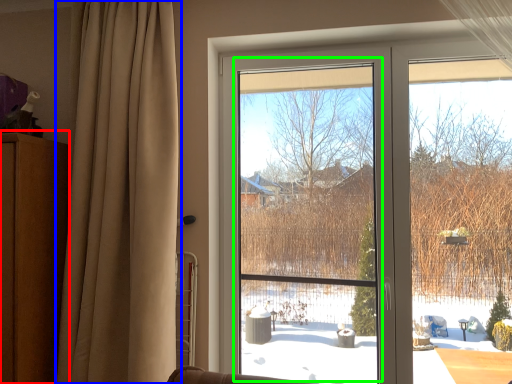
Question: Based on their relative distances, which object is farther from dresser (highlighted by a red box)? Choose from curtain (highlighted by a blue box) and window screen (highlighted by a green box).

Choices:
 (A) curtain
 (B) window screen

Answer: (B)